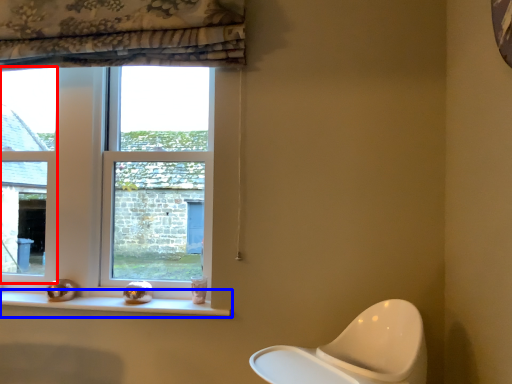
Question: Which object appears farthest to the camera in this image, window (highlighted by a red box) or window sill (highlighted by a blue box)?

Choices:
 (A) window
 (B) window sill

Answer: (A)